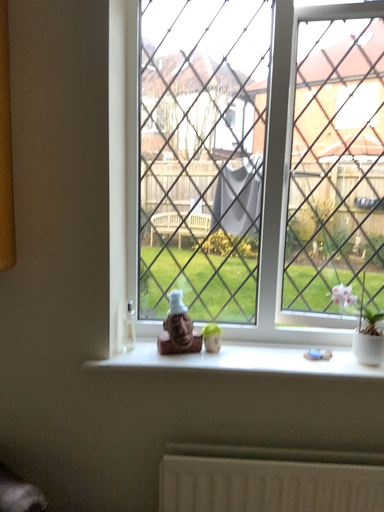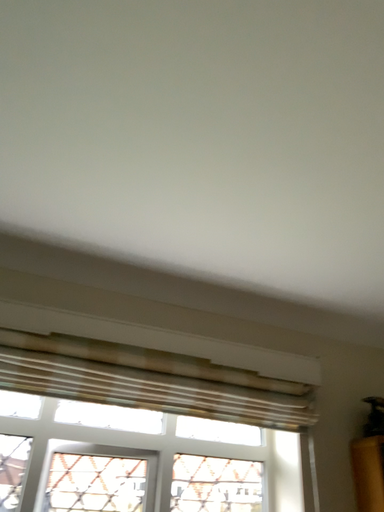
Question: How did the camera likely rotate when shooting the video?

Choices:
 (A) rotated upward
 (B) rotated downward

Answer: (A)